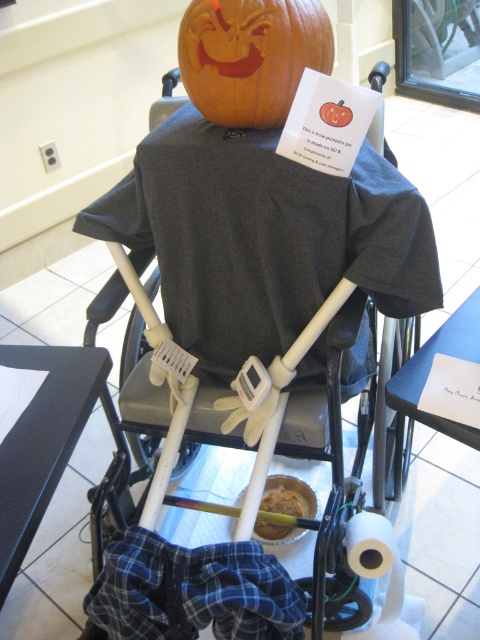
You are a delivery person who needs to deliver both the white plastic baby carriage at center and the golden brown bread at center to a customer. The customer has a small car with limited space. Which item should you load first to ensure both fit in the car?

The golden brown bread at center should be loaded first because the white plastic baby carriage at center has a larger size and will require more space. By placing the larger item first, there will be enough room left for the smaller bread.